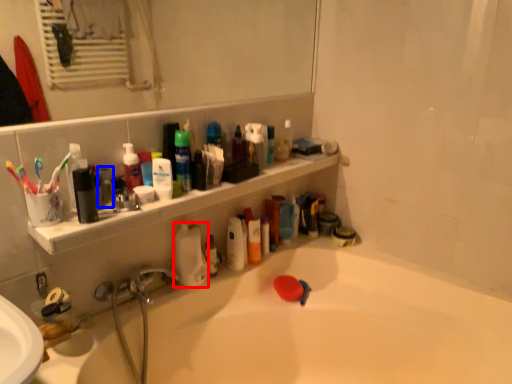
Question: Which of the following is the closest to the observer, cleaning product (highlighted by a red box) or mouthwash (highlighted by a blue box)?

Choices:
 (A) cleaning product
 (B) mouthwash

Answer: (B)